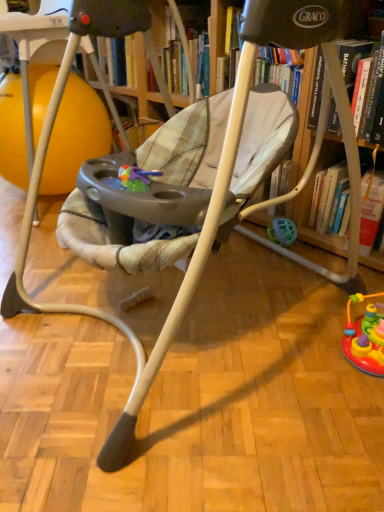
The image size is (384, 512). Describe the element at coordinates (75, 136) in the screenshot. I see `orange rubber ball at left` at that location.

In order to face orange rubber ball at left, should I rotate leftwards or rightwards?

To face it directly, rotate left by 18.957 degrees.

What is the approximate width of orange rubber ball at left?

It is 22.55 inches.

You are a GUI agent. You are given a task and a screenshot of the screen. Output one action in this format:
    pyautogui.click(x=<x>, y=<y>)
    Task: Click on the orange rubber ball at left
    
    Given the screenshot: What is the action you would take?
    pyautogui.click(x=75, y=136)

This screenshot has height=512, width=384. What do you see at coordinates (311, 200) in the screenshot?
I see `wooden bookshelf at right` at bounding box center [311, 200].

At what (x,y) coordinates should I click in order to perform the action: click on wooden bookshelf at right. Please return your answer as a coordinate pair (x, y). Image resolution: width=384 pixels, height=512 pixels. Looking at the image, I should click on (311, 200).

This screenshot has height=512, width=384. I want to click on orange rubber ball at left, so click(75, 136).

Can you confirm if orange rubber ball at left is positioned to the right of wooden bookshelf at right?

No.

Does orange rubber ball at left come in front of wooden bookshelf at right?

No, the depth of orange rubber ball at left is greater than that of wooden bookshelf at right.

Is point (68, 154) more distant than point (303, 135)?

Yes, it is behind point (303, 135).

From the image's perspective, does orange rubber ball at left appear lower than wooden bookshelf at right?

No, from the image's perspective, orange rubber ball at left is not below wooden bookshelf at right.

Looking at this image, from a real-world perspective, between orange rubber ball at left and wooden bookshelf at right, who is vertically lower?

wooden bookshelf at right is physically lower.

Between orange rubber ball at left and wooden bookshelf at right, which one has larger width?

Wider between the two is orange rubber ball at left.

Is orange rubber ball at left shorter than wooden bookshelf at right?

In fact, orange rubber ball at left may be taller than wooden bookshelf at right.

Considering the relative sizes of orange rubber ball at left and wooden bookshelf at right in the image provided, is orange rubber ball at left bigger than wooden bookshelf at right?

Yes, orange rubber ball at left is bigger than wooden bookshelf at right.

Is wooden bookshelf at right located within orange rubber ball at left?

No, wooden bookshelf at right is not inside orange rubber ball at left.

Is there a large distance between orange rubber ball at left and wooden bookshelf at right?

Yes, orange rubber ball at left and wooden bookshelf at right are quite far apart.

Is orange rubber ball at left looking in the opposite direction of wooden bookshelf at right?

No, orange rubber ball at left is not facing away from wooden bookshelf at right.

What's the angular difference between orange rubber ball at left and wooden bookshelf at right's facing directions?

orange rubber ball at left and wooden bookshelf at right are facing 90 degrees away from each other.

How distant is orange rubber ball at left from wooden bookshelf at right?

orange rubber ball at left is 3.28 feet from wooden bookshelf at right.

The width and height of the screenshot is (384, 512). Identify the location of ball above the wooden bookshelf at right (from a real-world perspective). (75, 136).

Considering the relative positions of wooden bookshelf at right and orange rubber ball at left in the image provided, is wooden bookshelf at right to the left or to the right of orange rubber ball at left?

wooden bookshelf at right is to the right of orange rubber ball at left.

Is wooden bookshelf at right further to the viewer compared to orange rubber ball at left?

That is False.

Which is farther from the camera, [300,119] or [30,83]?

The point [30,83] is farther.

From the image's perspective, is wooden bookshelf at right located above or below orange rubber ball at left?

Clearly, from the image's perspective, wooden bookshelf at right is below orange rubber ball at left.

From a real-world perspective, between wooden bookshelf at right and orange rubber ball at left, who is vertically lower?

From a 3D spatial view, wooden bookshelf at right is below.

Is wooden bookshelf at right wider than orange rubber ball at left?

No, wooden bookshelf at right is not wider than orange rubber ball at left.

Does wooden bookshelf at right have a greater height compared to orange rubber ball at left?

No.

In terms of size, does wooden bookshelf at right appear bigger or smaller than orange rubber ball at left?

Clearly, wooden bookshelf at right is smaller in size than orange rubber ball at left.

Is wooden bookshelf at right surrounding orange rubber ball at left?

No, orange rubber ball at left is not inside wooden bookshelf at right.

Is wooden bookshelf at right not near orange rubber ball at left?

That's right, there is a large distance between wooden bookshelf at right and orange rubber ball at left.

Is wooden bookshelf at right facing towards orange rubber ball at left?

No, wooden bookshelf at right is not aimed at orange rubber ball at left.

The width and height of the screenshot is (384, 512). What are the coordinates of `ball located on the left of wooden bookshelf at right` in the screenshot? It's located at (75, 136).

This screenshot has height=512, width=384. In the image, there is a wooden bookshelf at right. What are the coordinates of `ball above it (from the image's perspective)` in the screenshot? It's located at (75, 136).

I want to click on shelf below the orange rubber ball at left (from a real-world perspective), so click(x=311, y=200).